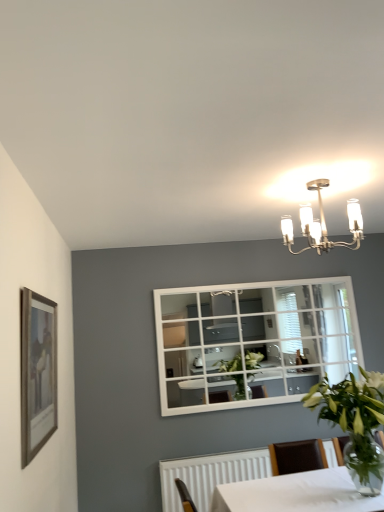
Question: Based on their sizes in the image, would you say wooden framed picture at left is bigger or smaller than green leafy plant in clear glass vase at lower right?

Choices:
 (A) small
 (B) big

Answer: (A)

Question: From the image's perspective, is wooden framed picture at left located above or below green leafy plant in clear glass vase at lower right?

Choices:
 (A) above
 (B) below

Answer: (A)

Question: Which is farther from the satin nickel chandelier at upper center?

Choices:
 (A) green leafy plant in clear glass vase at lower right
 (B) wooden framed picture at left

Answer: (B)

Question: Which object is positioned farthest from the wooden framed picture at left?

Choices:
 (A) satin nickel chandelier at upper center
 (B) green leafy plant in clear glass vase at lower right

Answer: (A)